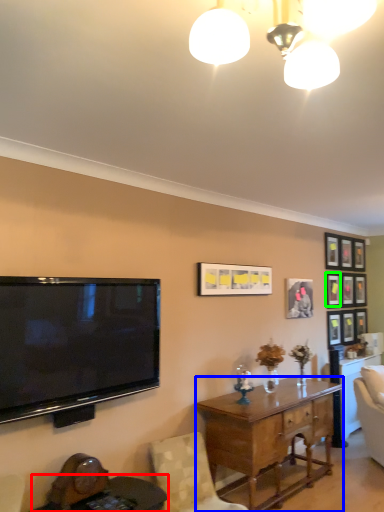
Question: Considering the real-world distances, which object is farthest from round table (highlighted by a red box)? desk (highlighted by a blue box) or picture frame (highlighted by a green box)?

Choices:
 (A) desk
 (B) picture frame

Answer: (B)